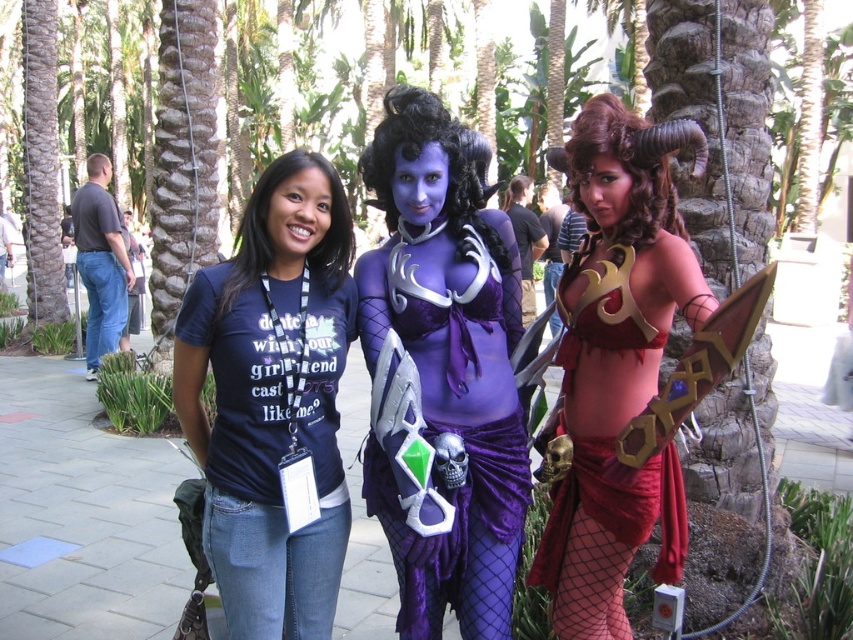
You are a photographer trying to capture a closeup of the purple velvet dress at center without including the matte purple armor at center in the shot. Based on their positions, is this possible? Please explain your reasoning.

The matte purple armor at center is to the right of the purple velvet dress at center. Since the armor is positioned to the right of the dress, you can adjust the camera angle or frame to exclude the armor by focusing solely on the left side of the dress, ensuring the right edge of the frame does not include the armor.